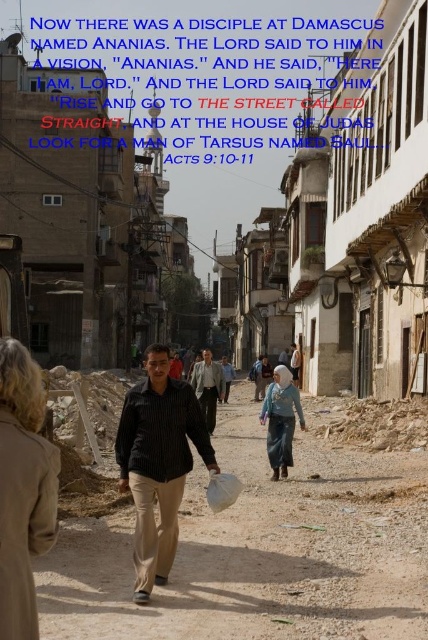
Question: Does black striped shirt at center have a lesser width compared to blue denim jeans at center?

Choices:
 (A) no
 (B) yes

Answer: (A)

Question: Which object appears farthest from the camera in this image?

Choices:
 (A) black striped shirt at center
 (B) light brown striped shirt at center
 (C) dark brown leather jacket at center
 (D) blue denim jeans at center

Answer: (C)

Question: Considering the relative positions of light brown striped shirt at center and dark brown leather jacket at center in the image provided, where is light brown striped shirt at center located with respect to dark brown leather jacket at center?

Choices:
 (A) left
 (B) right

Answer: (A)

Question: Does brown dirt road at center appear under light brown striped shirt at center?

Choices:
 (A) yes
 (B) no

Answer: (A)

Question: Considering the real-world distances, which object is farthest from the blue denim jeans at center?

Choices:
 (A) beige wool coat at center
 (B) brown dirt road at center

Answer: (A)

Question: Which object is positioned farthest from the brown dirt road at center?

Choices:
 (A) dark brown leather jacket at center
 (B) black striped shirt at center
 (C) light brown striped shirt at center

Answer: (A)